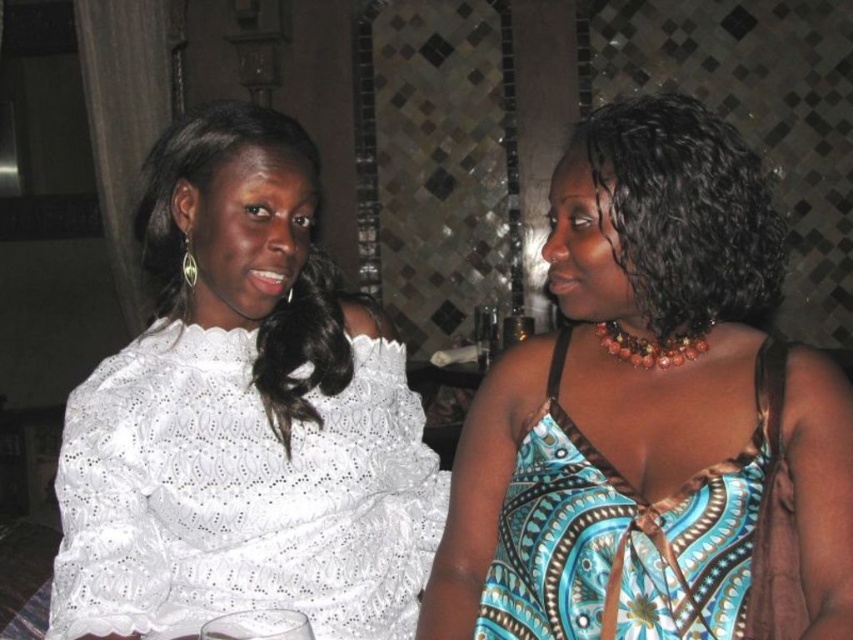
In the scene shown: You are a photographer setting up for a group photo. You need to ensure that both the blue printed dress at center and the blue printed fabric dress at right are fully visible in the frame. Given their widths, which dress requires more space to the left and right to avoid being cut off?

The blue printed dress at center is wider than the blue printed fabric dress at right, so it requires more space to the left and right to avoid being cut off.

In the scene shown: You are a fashion designer observing the scene. You need to determine which item of clothing has a wider silhouette between the white lace dress at left and the white lace blouse at upper left. Which one is wider?

The white lace blouse at upper left has a wider silhouette than the white lace dress at left, as the dress is described as thinner.